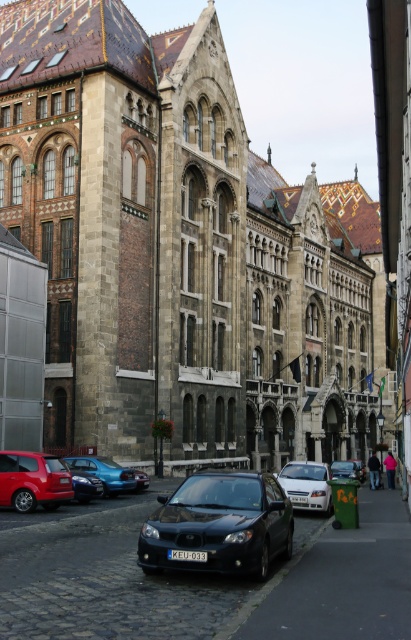
Question: Considering the relative positions of shiny black sedan at center and matte red car at lower left in the image provided, where is shiny black sedan at center located with respect to matte red car at lower left?

Choices:
 (A) above
 (B) below

Answer: (B)

Question: Which point is farther from the camera taking this photo?

Choices:
 (A) (339, 460)
 (B) (119, 472)
 (C) (180, 200)

Answer: (A)

Question: Does matte red car at lower left have a smaller size compared to metallic blue sedan at center?

Choices:
 (A) yes
 (B) no

Answer: (A)

Question: Is white metallic sedan at center to the left of silver metallic car at center from the viewer's perspective?

Choices:
 (A) yes
 (B) no

Answer: (A)

Question: Which of the following is the farthest from the observer?

Choices:
 (A) (83, 467)
 (B) (316, 381)

Answer: (B)

Question: Which point is farther to the camera?

Choices:
 (A) stone church at center
 (B) metallic blue sedan at center
 (C) matte red car at lower left

Answer: (A)